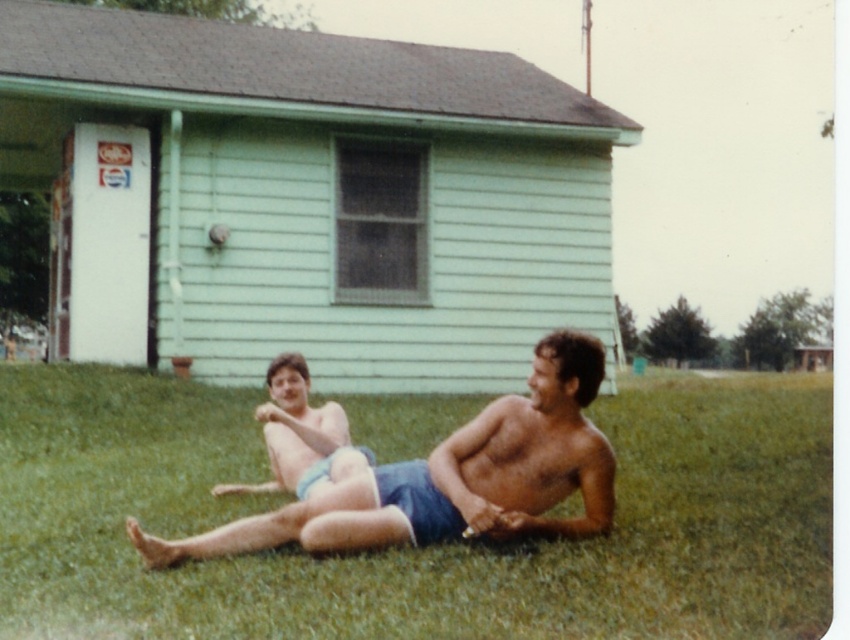
Can you confirm if green grass at center is wider than blue fabric shorts at center?

Yes, green grass at center is wider than blue fabric shorts at center.

At what (x,y) coordinates should I click in order to perform the action: click on green grass at center. Please return your answer as a coordinate pair (x, y). This screenshot has width=850, height=640. Looking at the image, I should click on (414, 548).

Where is `green grass at center`? This screenshot has height=640, width=850. green grass at center is located at coordinates (414, 548).

Who is lower down, blue denim shorts at center or blue fabric shorts at center?

blue denim shorts at center

Does blue denim shorts at center lie behind blue fabric shorts at center?

No.

What do you see at coordinates (452, 477) in the screenshot?
I see `blue denim shorts at center` at bounding box center [452, 477].

At what (x,y) coordinates should I click in order to perform the action: click on blue denim shorts at center. Please return your answer as a coordinate pair (x, y). The width and height of the screenshot is (850, 640). Looking at the image, I should click on (452, 477).

Which is more to the left, green grass at center or blue denim shorts at center?

blue denim shorts at center is more to the left.

Is green grass at center above blue denim shorts at center?

No, green grass at center is not above blue denim shorts at center.

Which is in front, point (542, 577) or point (246, 544)?

Point (542, 577)

This screenshot has width=850, height=640. Find the location of `green grass at center`. green grass at center is located at coordinates (414, 548).